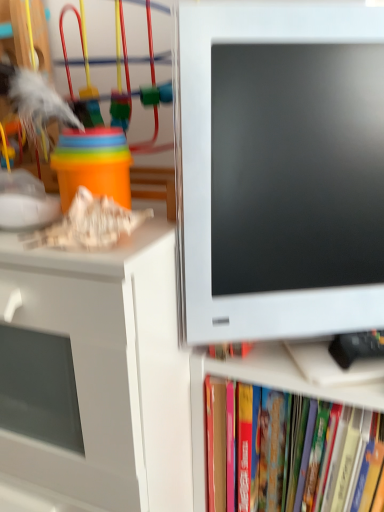
Question: Relative to hardcover book at lower right, is satin white monitor at right in front or behind?

Choices:
 (A) behind
 (B) front

Answer: (B)

Question: From a real-world perspective, is satin white monitor at right physically located above or below hardcover book at lower right?

Choices:
 (A) above
 (B) below

Answer: (A)

Question: Estimate the real-world distances between objects in this image. Which object is farther from the matte plastic cups at upper left?

Choices:
 (A) satin white monitor at right
 (B) white glossy cabinet at left
 (C) hardcover book at lower right

Answer: (C)

Question: Which object is positioned farthest from the white glossy cabinet at left?

Choices:
 (A) matte plastic cups at upper left
 (B) satin white monitor at right
 (C) hardcover book at lower right

Answer: (A)